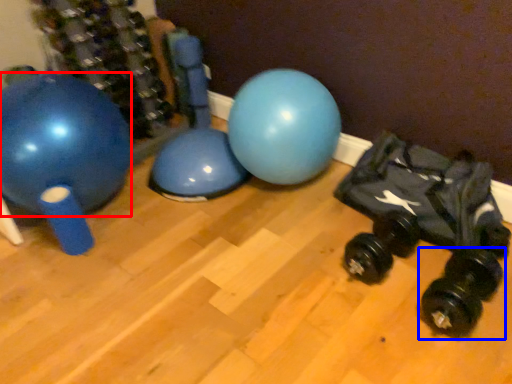
Question: Which object appears farthest to the camera in this image, ball (highlighted by a red box) or dumbbell (highlighted by a blue box)?

Choices:
 (A) ball
 (B) dumbbell

Answer: (A)